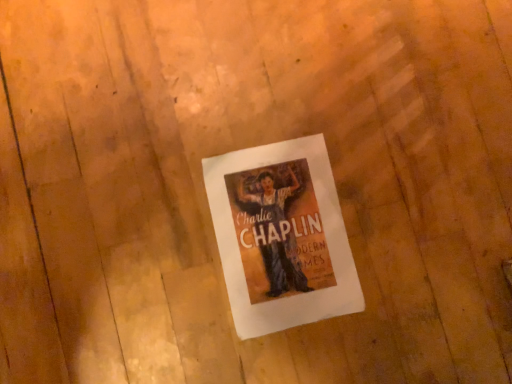
This screenshot has width=512, height=384. I want to click on free location to the right of white paper at center, so [418, 246].